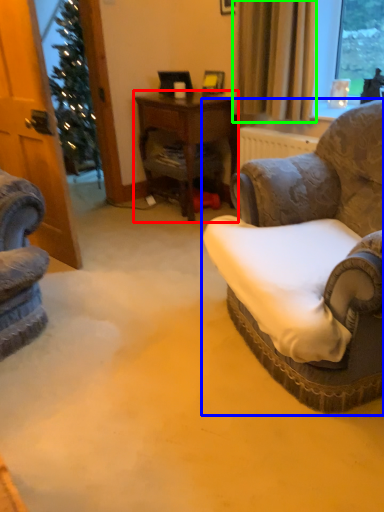
Question: Estimate the real-world distances between objects in this image. Which object is closer to desk (highlighted by a red box), chair (highlighted by a blue box) or curtain (highlighted by a green box)?

Choices:
 (A) chair
 (B) curtain

Answer: (B)